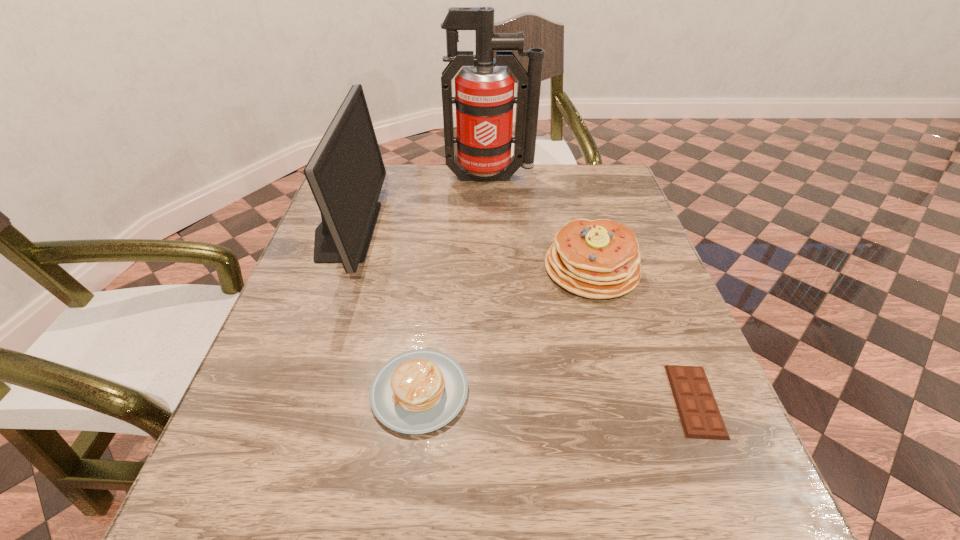
Locate an element on the screen. The height and width of the screenshot is (540, 960). blank area at the near edge is located at coordinates (606, 500).

The image size is (960, 540). Identify the location of vacant space at the left edge of the desktop. (309, 295).

The height and width of the screenshot is (540, 960). What are the coordinates of `vacant space at the right edge` in the screenshot? It's located at (636, 305).

In order to click on vacant space at the near left corner in this screenshot , I will do coord(193,514).

In the image, there is a desktop. Where is `vacant space at the far right corner`? The width and height of the screenshot is (960, 540). vacant space at the far right corner is located at coordinates (589, 183).

Where is `empty space that is in between the leftmost object and the fire extinguisher`? empty space that is in between the leftmost object and the fire extinguisher is located at coordinates (419, 204).

I want to click on free space between the chocolate bar and the shorter pancake, so 558,396.

Locate an element on the screen. The height and width of the screenshot is (540, 960). vacant space in between the shortest object and the computer monitor is located at coordinates 520,315.

The image size is (960, 540). I want to click on empty space that is in between the right pancake and the fire extinguisher, so click(540, 223).

The width and height of the screenshot is (960, 540). What are the coordinates of `vacant area between the shortest object and the leftmost object` in the screenshot? It's located at (520, 315).